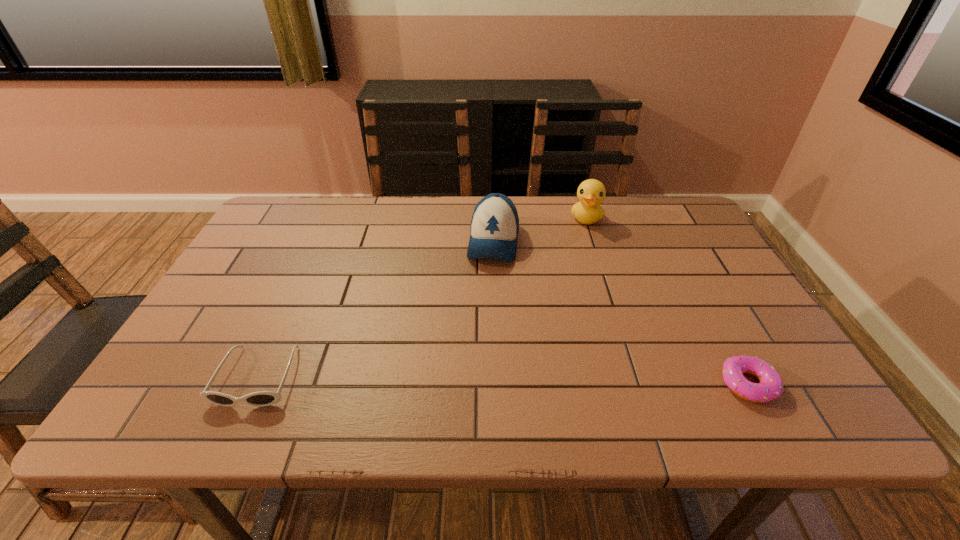
I want to click on vacant space located 0.320m on the face of the duck, so click(575, 302).

At what (x,y) coordinates should I click in order to perform the action: click on vacant point located on the face of the duck. Please return your answer as a coordinate pair (x, y). Looking at the image, I should click on (581, 262).

Find the location of a particular element. This screenshot has height=540, width=960. vacant space located on the face of the duck is located at coordinates (581, 262).

Identify the location of baseball cap positioned at the far edge. This screenshot has width=960, height=540. (494, 229).

In order to click on duck that is at the far edge in this screenshot , I will do `click(591, 192)`.

Locate an element on the screen. sunglasses that is at the near edge is located at coordinates (262, 398).

Locate an element on the screen. doughnut present at the near edge is located at coordinates (771, 386).

This screenshot has width=960, height=540. I want to click on object present at the left edge, so click(262, 398).

What are the coordinates of `object present at the right edge` in the screenshot? It's located at (771, 386).

At what (x,y) coordinates should I click in order to perform the action: click on object positioned at the near left corner. Please return your answer as a coordinate pair (x, y). The height and width of the screenshot is (540, 960). Looking at the image, I should click on (262, 398).